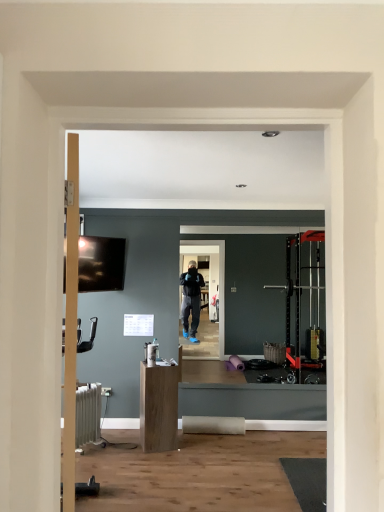
Question: Based on their sizes in the image, would you say white metallic radiator at lower left is bigger or smaller than matte black tv at upper left?

Choices:
 (A) small
 (B) big

Answer: (B)

Question: From the image's perspective, relative to matte black tv at upper left, is white metallic radiator at lower left above or below?

Choices:
 (A) above
 (B) below

Answer: (B)

Question: Which object is the closest to the matte black tv at upper left?

Choices:
 (A) white metallic radiator at lower left
 (B) light brown wood cabinet at center

Answer: (A)

Question: Which of these objects is positioned closest to the matte black tv at upper left?

Choices:
 (A) light brown wood cabinet at center
 (B) white metallic radiator at lower left

Answer: (B)